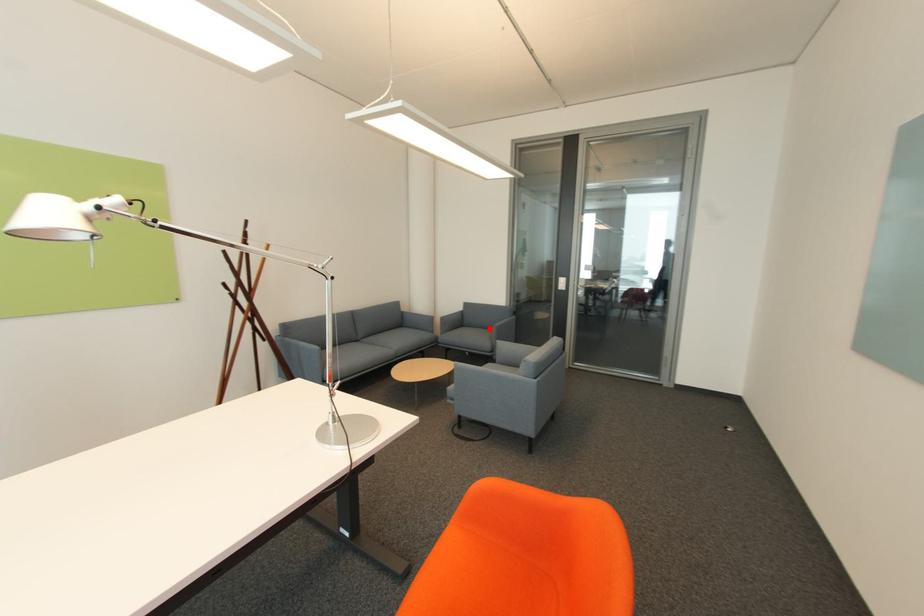
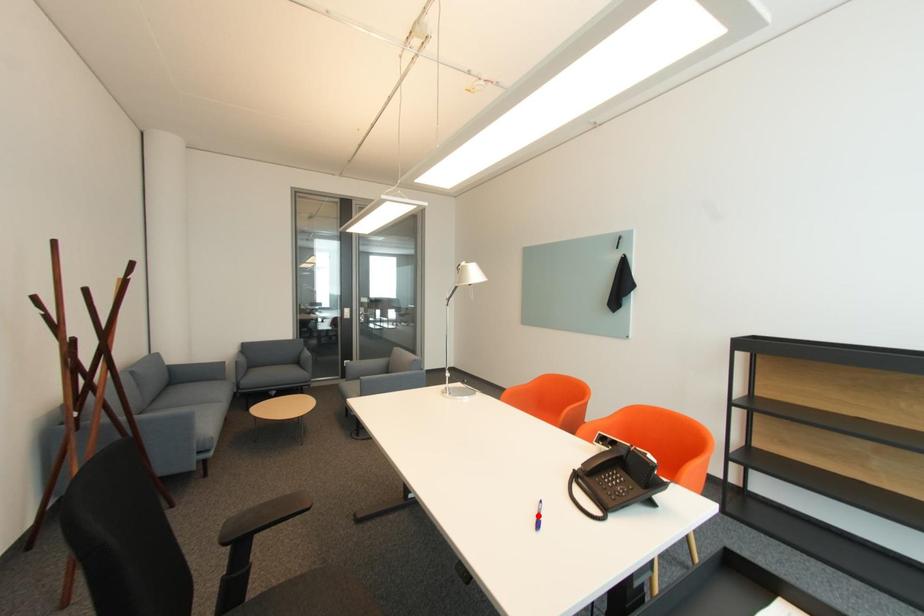
I am providing you with two images of the same scene from different viewpoints. A red point is marked on the first image and another point is marked on the second image. Do the highlighted points in image1 and image2 indicate the same real-world spot?

No